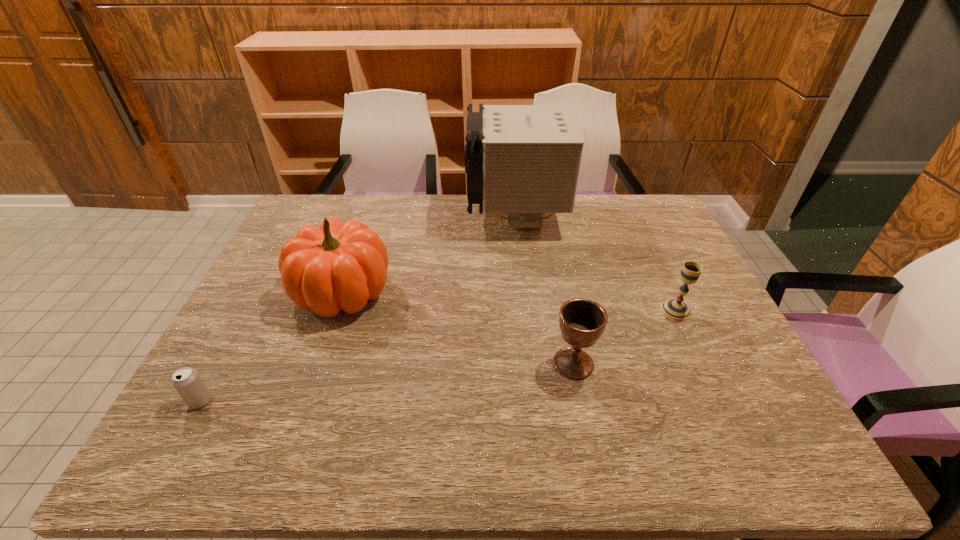
You are a GUI agent. You are given a task and a screenshot of the screen. Output one action in this format:
    pyautogui.click(x=<x>, y=<y>)
    Task: Click on the vacant space located 0.130m on the left of the fan
    
    Given the screenshot: What is the action you would take?
    pyautogui.click(x=429, y=217)

This screenshot has width=960, height=540. I want to click on vacant position located on the front of the second object from left to right, so click(x=316, y=366).

The width and height of the screenshot is (960, 540). In order to click on vacant space located 0.320m on the back of the fourth farthest object in this screenshot , I will do `click(554, 265)`.

At what (x,y) coordinates should I click in order to perform the action: click on free space located on the left of the rightmost object. Please return your answer as a coordinate pair (x, y). The image size is (960, 540). Looking at the image, I should click on (513, 310).

Find the location of a particular element. The image size is (960, 540). vacant space located on the front of the nearest object is located at coordinates (166, 464).

Find the location of a particular element. The width and height of the screenshot is (960, 540). object located at the far edge is located at coordinates (523, 161).

You are a GUI agent. You are given a task and a screenshot of the screen. Output one action in this format:
    pyautogui.click(x=<x>, y=<y>)
    Task: Click on the pumpkin positioned at the left edge
    The height and width of the screenshot is (540, 960).
    Given the screenshot: What is the action you would take?
    pyautogui.click(x=338, y=266)

Image resolution: width=960 pixels, height=540 pixels. What are the coordinates of `beer can that is positioned at the left edge` in the screenshot? It's located at (187, 381).

Identify the location of object situated at the right edge. (674, 309).

In the image, there is a desktop. At what (x,y) coordinates should I click in order to perform the action: click on free space at the far edge. Please return your answer as a coordinate pair (x, y). This screenshot has width=960, height=540. Looking at the image, I should click on (452, 215).